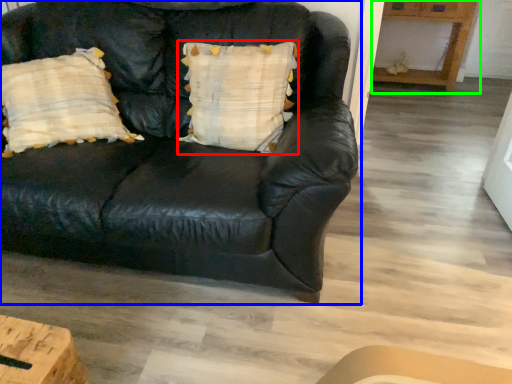
Question: Estimate the real-world distances between objects in this image. Which object is farther from pillow (highlighted by a red box), studio couch (highlighted by a blue box) or table (highlighted by a green box)?

Choices:
 (A) studio couch
 (B) table

Answer: (B)